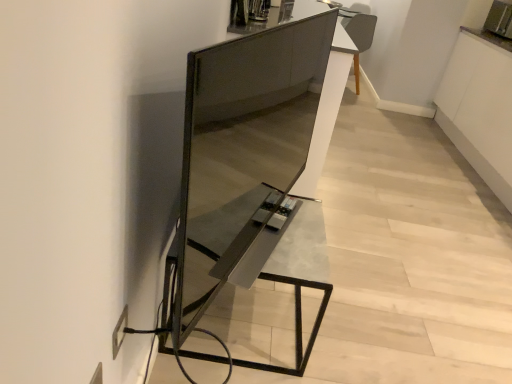
Question: Looking at the image, does metallic gray table at center seem bigger or smaller compared to metallic silver toaster at upper right?

Choices:
 (A) big
 (B) small

Answer: (A)

Question: Do you think metallic gray table at center is within metallic silver toaster at upper right, or outside of it?

Choices:
 (A) inside
 (B) outside

Answer: (B)

Question: Which of these objects is positioned closest to the satin black tv stand at center?

Choices:
 (A) metallic silver toaster at upper right
 (B) metallic gray table at center

Answer: (B)

Question: Which is nearer to the metallic silver toaster at upper right?

Choices:
 (A) satin black tv stand at center
 (B) metallic gray table at center

Answer: (A)